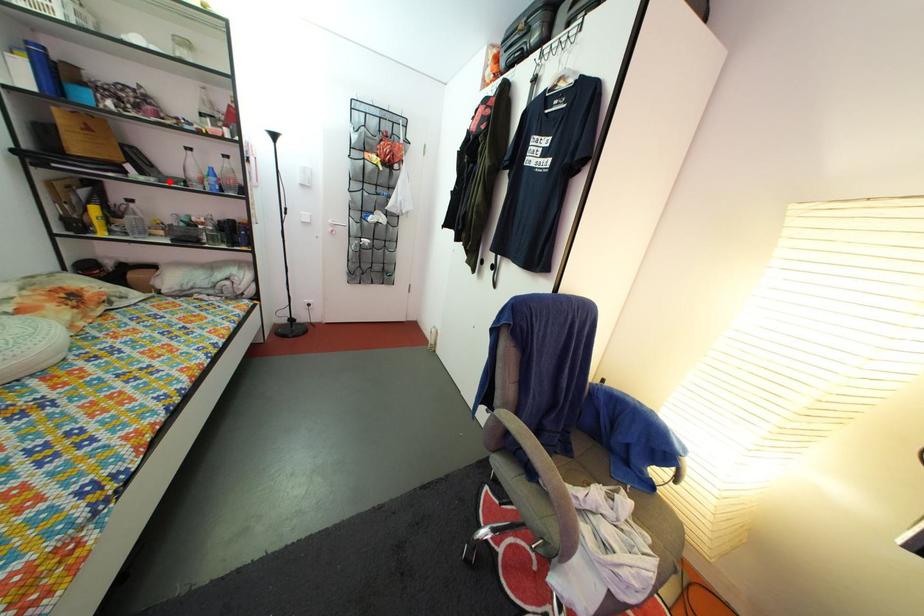
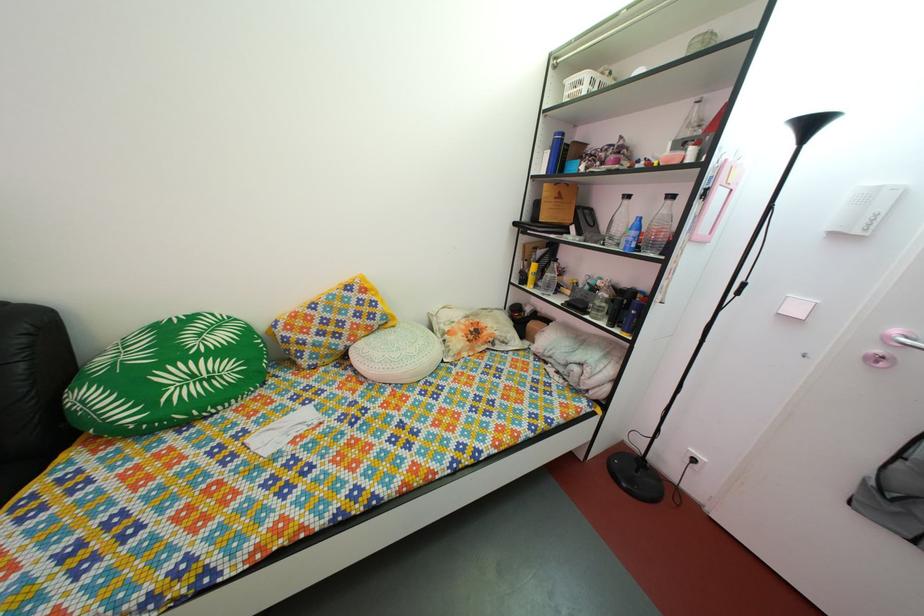
In the second image, find the point that corresponds to the highlighted location in the first image.

(608, 241)